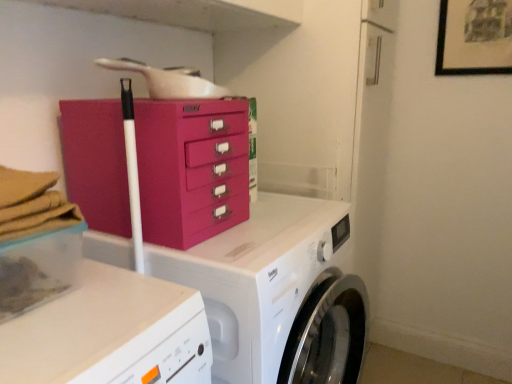
Find the location of `vacant space to the right of fuchsia plastic chest of drawers at center`. vacant space to the right of fuchsia plastic chest of drawers at center is located at coordinates (278, 224).